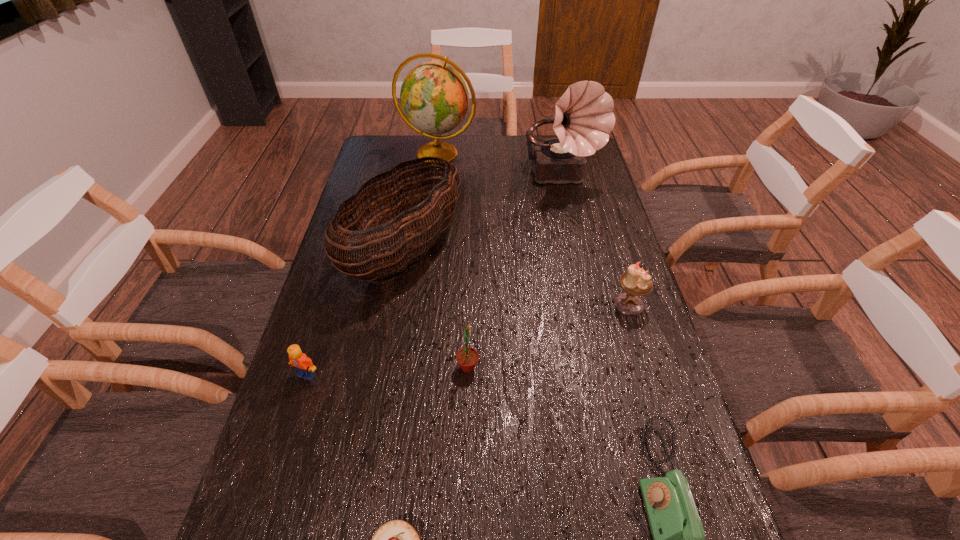
Identify the location of vacant space located 0.090m on the face of the sunflower. (516, 367).

Identify the location of vacant position located on the front-facing side of the sixth tallest object. (269, 496).

I want to click on globe situated at the far edge, so coord(434,98).

Where is `record player situated at the far edge`? record player situated at the far edge is located at coordinates (584, 118).

This screenshot has width=960, height=540. Identify the location of globe present at the left edge. (434, 98).

The height and width of the screenshot is (540, 960). Find the location of `basket at the left edge`. basket at the left edge is located at coordinates (406, 241).

The height and width of the screenshot is (540, 960). What are the coordinates of `Lego that is at the left edge` in the screenshot? It's located at (305, 369).

The image size is (960, 540). I want to click on record player present at the right edge, so click(584, 118).

You are a GUI agent. You are given a task and a screenshot of the screen. Output one action in this format:
    pyautogui.click(x=<x>, y=<y>)
    Task: Click on the candle holder that is at the right edge
    
    Given the screenshot: What is the action you would take?
    pyautogui.click(x=635, y=282)

You are a GUI agent. You are given a task and a screenshot of the screen. Output one action in this format:
    pyautogui.click(x=<x>, y=<y>)
    Task: Click on the object that is at the far left corner
    
    Given the screenshot: What is the action you would take?
    pyautogui.click(x=434, y=98)